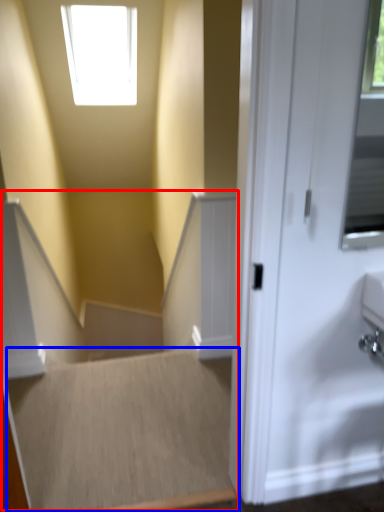
Question: Which point is closer to the camera, stairwell (highlighted by a red box) or stairwell (highlighted by a blue box)?

Choices:
 (A) stairwell
 (B) stairwell

Answer: (A)